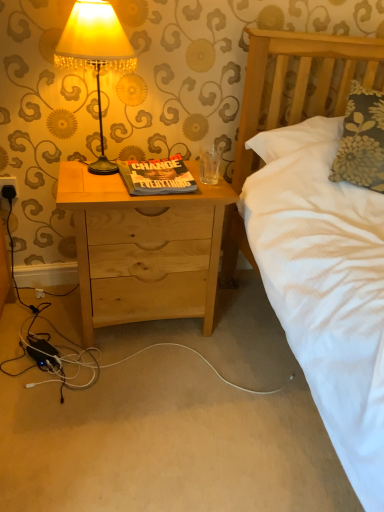
Identify the location of free spot below matte yellow fabric lampshade at upper left (from a real-world perspective). (94, 170).